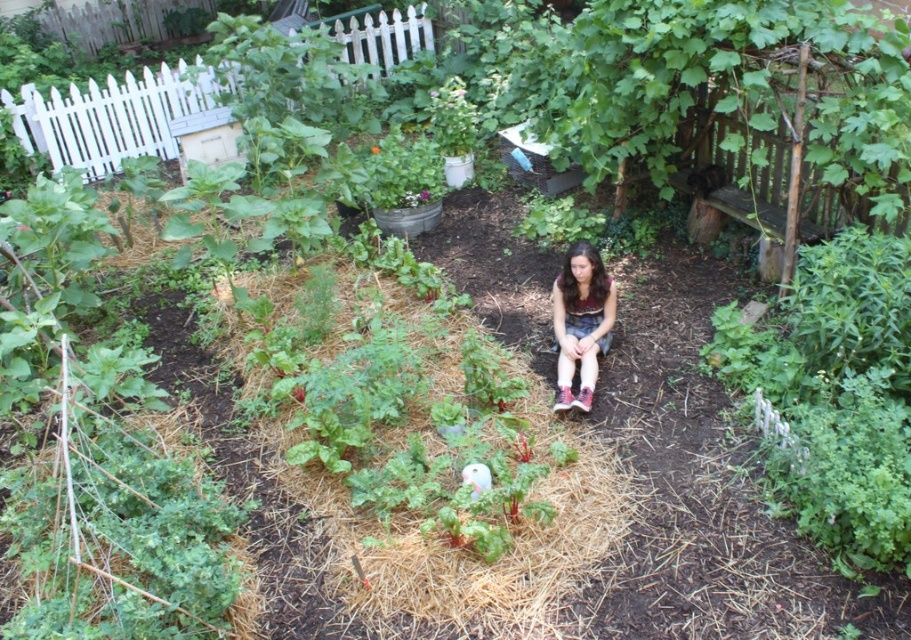
You are a gardener working in the garden and you see the brown straw at center and the matte brown shorts at center. Which object is located to the left side of the other?

Answer: The brown straw at center is to the left of matte brown shorts at center.

Looking at this image, you are a gardener who wants to plant a new flower in the garden. You have a small flower pot that is 15 cm tall. You see the brown straw at center and the wooden planter at center. Which object can the flower pot fit under without being blocked?

The flower pot can fit under the brown straw at center because it is taller than the wooden planter at center, so the flower pot would be blocked by the wooden planter but not by the straw.

You are a gardener kneeling in the garden and want to place a new plant between the matte brown shorts at center and the wooden planter at center. Which object should you place the plant closer to if you want it to be closer to the taller object?

The matte brown shorts at center is taller than the wooden planter at center, so you should place the plant closer to the matte brown shorts at center to be nearer to the taller object.